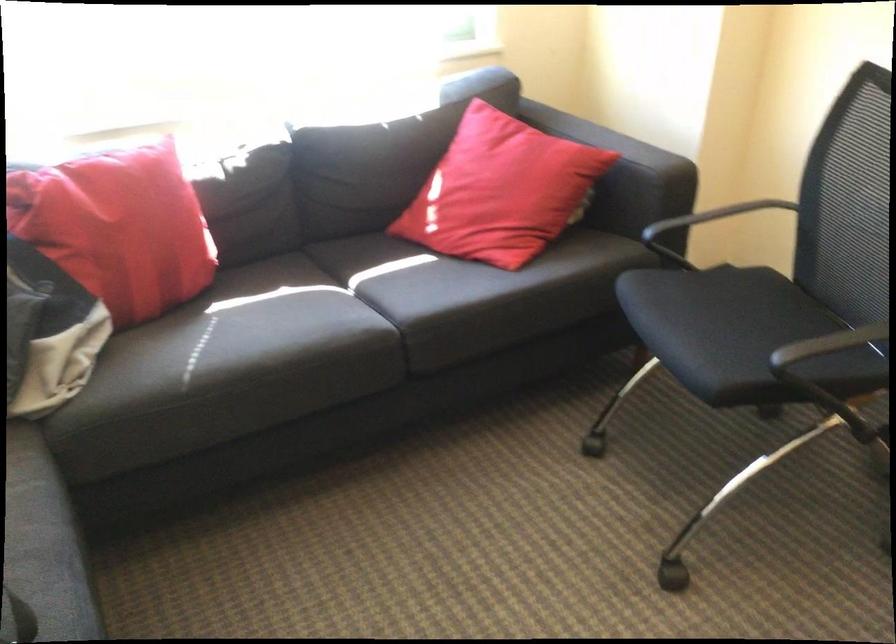
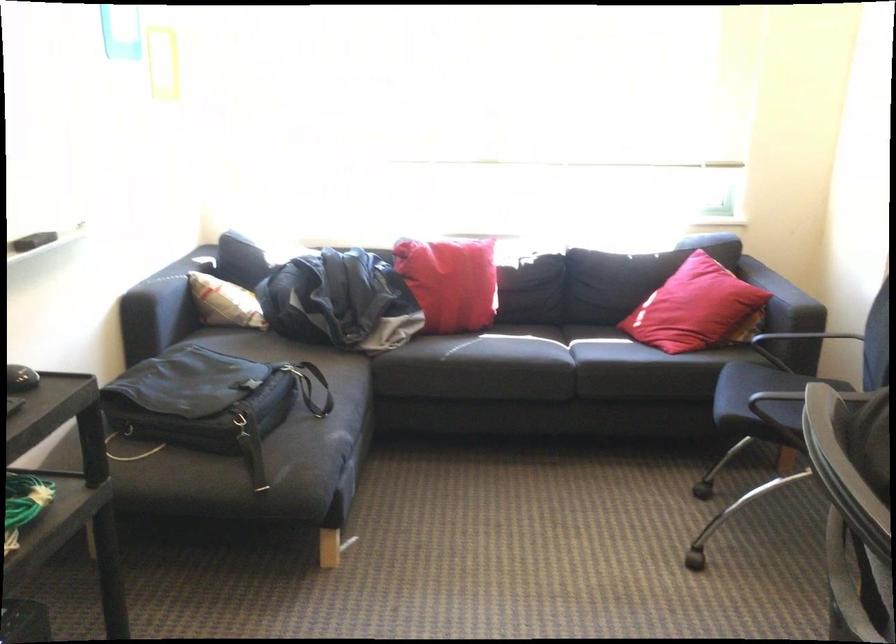
In the second image, find the point that corresponds to (341,351) in the first image.

(535, 364)